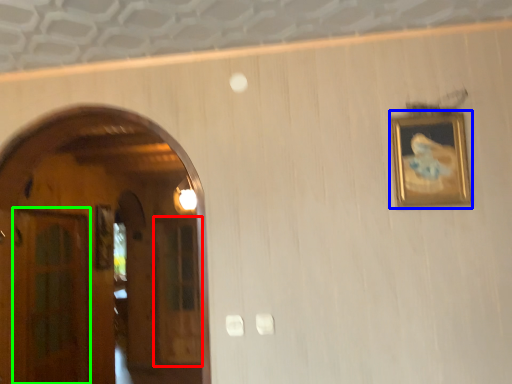
Question: Estimate the real-world distances between objects in this image. Which object is closer to glass door (highlighted by a red box), picture frame (highlighted by a blue box) or glass door (highlighted by a green box)?

Choices:
 (A) picture frame
 (B) glass door

Answer: (B)